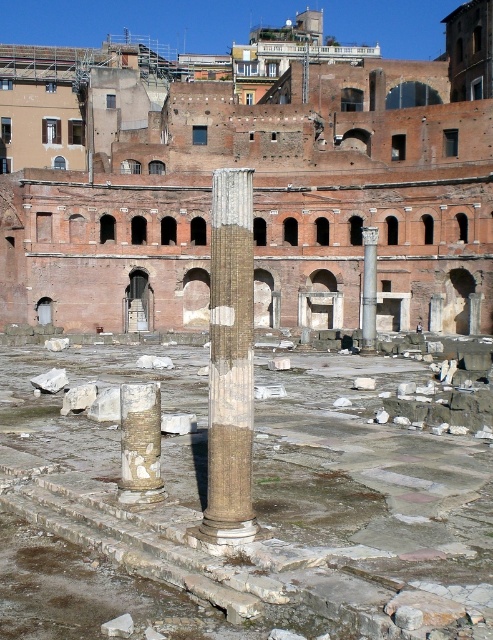
You are an archaeologist examining the ancient Roman ruin. You notice two columns in the scene. Which one is closer to you, the brown stone column at center or the smooth stone column at center?

The brown stone column at center is closer to you because it is positioned in front of the smooth stone column at center.

You are an archaeologist standing at the coordinates 0.5, 0.5 in the image. You need to locate the brown stone column at center. In which direction should you move to reach it?

The brown stone column at center is located at point (231, 362). Since you are at (246, 320), you should move northeast to reach it.